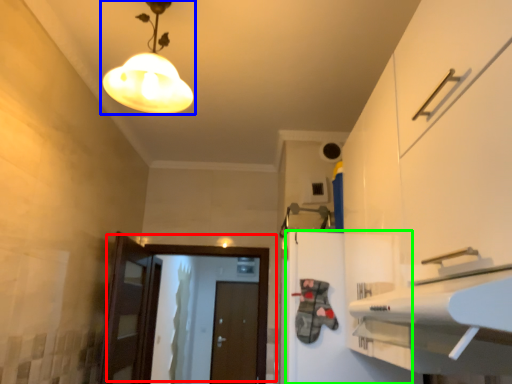
Question: Which object is the closest to the door (highlighted by a red box)? Choose among these: lamp (highlighted by a blue box) or cabinetry (highlighted by a green box).

Choices:
 (A) lamp
 (B) cabinetry

Answer: (B)